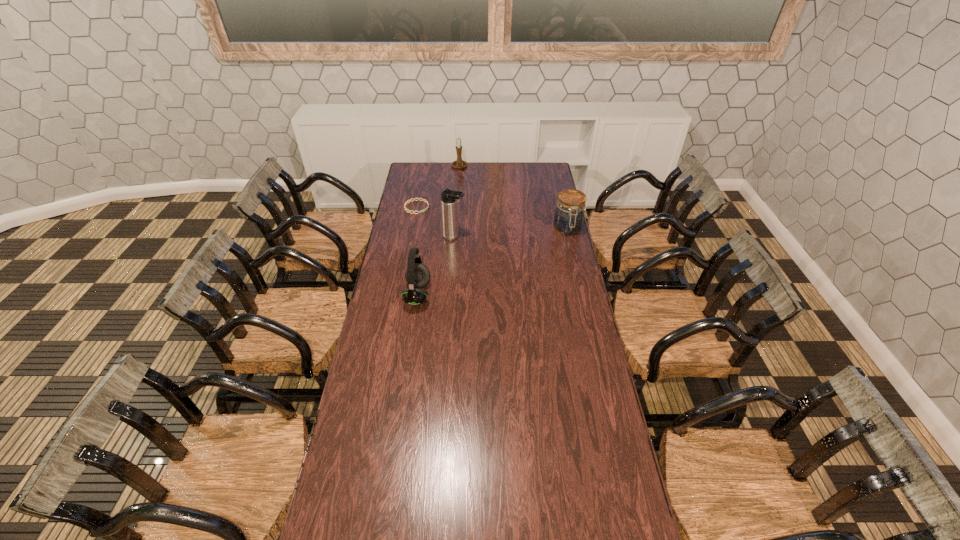
Find the location of a particular element. This screenshot has height=540, width=960. vacant space on the desktop that is between the headset and the jar and is positioned on the handle side of the tallest object is located at coordinates (508, 255).

Where is `vacant space on the desktop that is between the headset and the jar and is positioned on the side of the farthest object with the handle`? The height and width of the screenshot is (540, 960). vacant space on the desktop that is between the headset and the jar and is positioned on the side of the farthest object with the handle is located at coordinates (483, 266).

This screenshot has width=960, height=540. In order to click on free space on the desktop that is between the headset and the jar and is positioned on the surface of the bracelet showing star-shaped elements in this screenshot , I will do `click(519, 250)`.